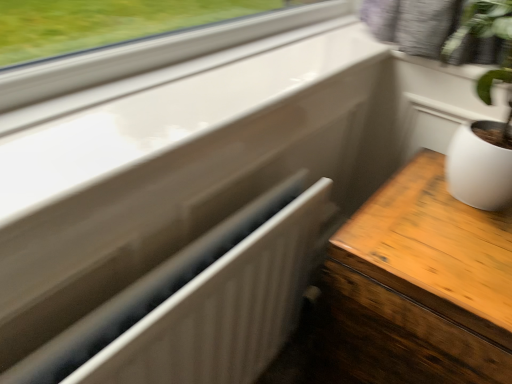
Image resolution: width=512 pixels, height=384 pixels. Describe the element at coordinates (420, 286) in the screenshot. I see `wooden table at right` at that location.

Image resolution: width=512 pixels, height=384 pixels. I want to click on wooden table at right, so click(x=420, y=286).

Identify the location of white matte radiator at center. The height and width of the screenshot is (384, 512). (223, 309).

Describe the element at coordinates (223, 309) in the screenshot. I see `white matte radiator at center` at that location.

Identify the location of wooden table at right. pyautogui.click(x=420, y=286).

Between wooden table at right and white matte radiator at center, which one appears on the left side from the viewer's perspective?

white matte radiator at center.

Which object is closer to the camera, wooden table at right or white matte radiator at center?

white matte radiator at center is in front.

Between point (462, 228) and point (258, 304), which one is positioned behind?

Point (462, 228)

From the image's perspective, would you say wooden table at right is shown under white matte radiator at center?

Yes, from the image's perspective, wooden table at right is beneath white matte radiator at center.

From a real-world perspective, is wooden table at right physically located above or below white matte radiator at center?

From a real-world perspective, wooden table at right is physically below white matte radiator at center.

Considering the sizes of objects wooden table at right and white matte radiator at center in the image provided, who is wider, wooden table at right or white matte radiator at center?

wooden table at right.

Can you confirm if wooden table at right is shorter than white matte radiator at center?

No, wooden table at right is not shorter than white matte radiator at center.

Looking at this image, based on their sizes in the image, would you say wooden table at right is bigger or smaller than white matte radiator at center?

In the image, wooden table at right appears to be larger than white matte radiator at center.

From the picture: Does wooden table at right contain white matte radiator at center?

No, wooden table at right does not contain white matte radiator at center.

Is wooden table at right positioned far away from white matte radiator at center?

No, wooden table at right is in close proximity to white matte radiator at center.

Is wooden table at right positioned with its back to white matte radiator at center?

No, white matte radiator at center is not at the back of wooden table at right.

How many degrees apart are the facing directions of wooden table at right and white matte radiator at center?

89.9 degrees.

This screenshot has width=512, height=384. What are the coordinates of `radiator to the left of wooden table at right` in the screenshot? It's located at (223, 309).

Between white matte radiator at center and wooden table at right, which one appears on the right side from the viewer's perspective?

wooden table at right.

Considering the relative positions of white matte radiator at center and wooden table at right in the image provided, is white matte radiator at center behind wooden table at right?

No, it is not.

Considering the points (157, 360) and (431, 227), which point is behind, point (157, 360) or point (431, 227)?

The point (431, 227) is farther.

From the image's perspective, is white matte radiator at center above or below wooden table at right?

white matte radiator at center is situated higher than wooden table at right in the image.

From a real-world perspective, is white matte radiator at center physically below wooden table at right?

No, from a real-world perspective, white matte radiator at center is not under wooden table at right.

Looking at their sizes, would you say white matte radiator at center is wider or thinner than wooden table at right?

In the image, white matte radiator at center appears to be more narrow than wooden table at right.

Can you confirm if white matte radiator at center is shorter than wooden table at right?

Yes, white matte radiator at center is shorter than wooden table at right.

Considering the relative sizes of white matte radiator at center and wooden table at right in the image provided, is white matte radiator at center bigger than wooden table at right?

No, white matte radiator at center is not bigger than wooden table at right.

Choose the correct answer: Is white matte radiator at center inside wooden table at right or outside it?

white matte radiator at center is not enclosed by wooden table at right.

Are white matte radiator at center and wooden table at right located far from each other?

No, white matte radiator at center is not far away from wooden table at right.

Does white matte radiator at center turn towards wooden table at right?

No, white matte radiator at center is not facing towards wooden table at right.

Can you tell me how much white matte radiator at center and wooden table at right differ in facing direction?

white matte radiator at center and wooden table at right are facing 89.9 degrees away from each other.

Where is `table below the white matte radiator at center (from the image's perspective)`? The width and height of the screenshot is (512, 384). table below the white matte radiator at center (from the image's perspective) is located at coordinates (420, 286).

Identify the location of table below the white matte radiator at center (from the image's perspective). (420, 286).

At what (x,y) coordinates should I click in order to perform the action: click on radiator above the wooden table at right (from the image's perspective). Please return your answer as a coordinate pair (x, y). Looking at the image, I should click on [223, 309].